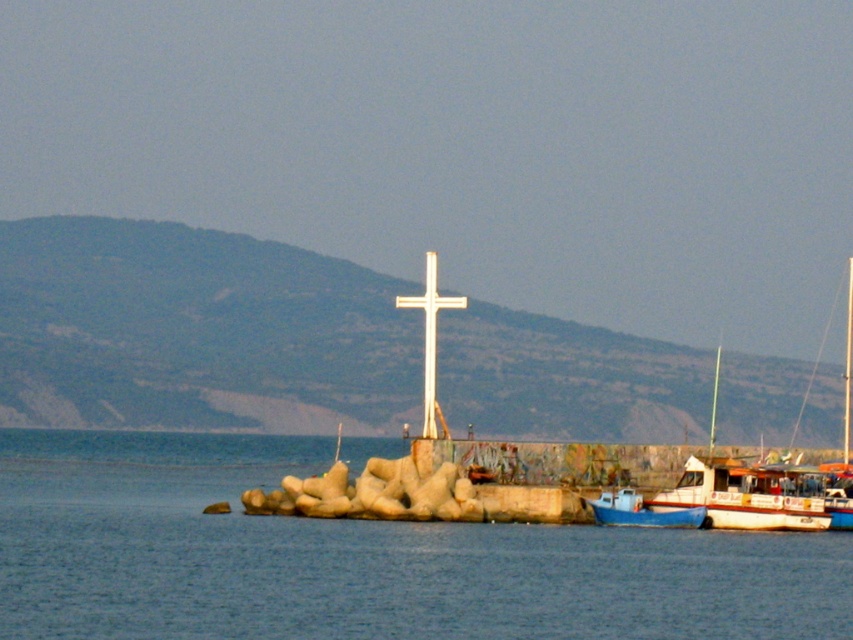
You are standing at the base of the white cross on the rocky outcrop and want to locate two points marked in the image. Which of the two points, point (x=397, y=582) or point (x=616, y=513), is closer to you?

Point (x=397, y=582) is closer to the viewer than point (x=616, y=513).

You are a photographer planning to capture the white plastic boat at lower right and the white metallic cross at center in a single frame. Given that the cross is much taller than the boat, how might their sizes appear in the photo compared to each other?

The white metallic cross at center is taller than the white plastic boat at lower right, so in the photo, the cross will appear larger than the boat.